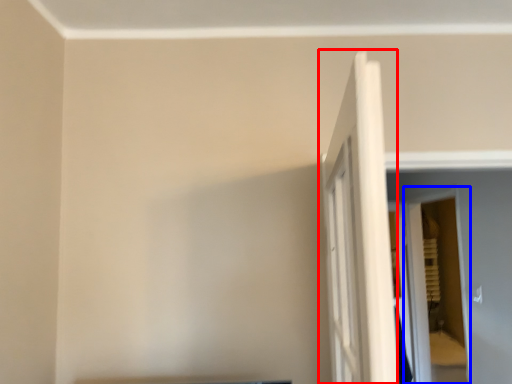
Question: Which of the following is the farthest to the observer, door (highlighted by a red box) or screen door (highlighted by a blue box)?

Choices:
 (A) door
 (B) screen door

Answer: (B)